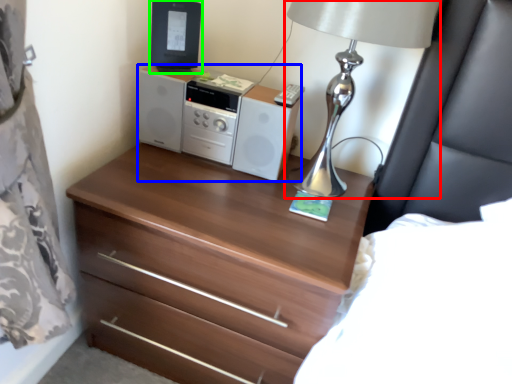
Question: Which object is positioned farthest from table lamp (highlighted by a red box)? Select from stereo (highlighted by a blue box) and desktop computer (highlighted by a green box).

Choices:
 (A) stereo
 (B) desktop computer

Answer: (B)